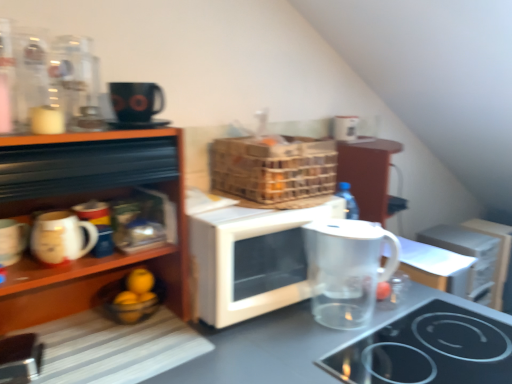
Question: Does transparent glass jug at lower right come behind transparent plastic pitcher at lower right?

Choices:
 (A) yes
 (B) no

Answer: (B)

Question: Can you confirm if transparent glass jug at lower right is smaller than transparent plastic pitcher at lower right?

Choices:
 (A) yes
 (B) no

Answer: (B)

Question: From a real-world perspective, is transparent glass jug at lower right on transparent plastic pitcher at lower right?

Choices:
 (A) yes
 (B) no

Answer: (A)

Question: Can you confirm if transparent glass jug at lower right is bigger than transparent plastic pitcher at lower right?

Choices:
 (A) no
 (B) yes

Answer: (B)

Question: Does transparent glass jug at lower right appear on the left side of transparent plastic pitcher at lower right?

Choices:
 (A) yes
 (B) no

Answer: (A)

Question: From the image's perspective, is transparent glass jug at lower right under transparent plastic pitcher at lower right?

Choices:
 (A) no
 (B) yes

Answer: (A)

Question: Is transparent plastic pitcher at lower right surrounding black glass cooktop at lower right?

Choices:
 (A) no
 (B) yes

Answer: (A)

Question: Does transparent plastic pitcher at lower right have a lesser width compared to black glass cooktop at lower right?

Choices:
 (A) no
 (B) yes

Answer: (B)

Question: Could you tell me if transparent plastic pitcher at lower right is turned towards black glass cooktop at lower right?

Choices:
 (A) no
 (B) yes

Answer: (A)

Question: Can you confirm if transparent plastic pitcher at lower right is smaller than black glass cooktop at lower right?

Choices:
 (A) no
 (B) yes

Answer: (B)

Question: Is transparent plastic pitcher at lower right behind black glass cooktop at lower right?

Choices:
 (A) no
 (B) yes

Answer: (B)

Question: Can you confirm if transparent plastic pitcher at lower right is taller than black glass cooktop at lower right?

Choices:
 (A) no
 (B) yes

Answer: (B)

Question: Can you confirm if transparent glass pitcher at center is wider than transparent glass jug at lower right?

Choices:
 (A) yes
 (B) no

Answer: (A)